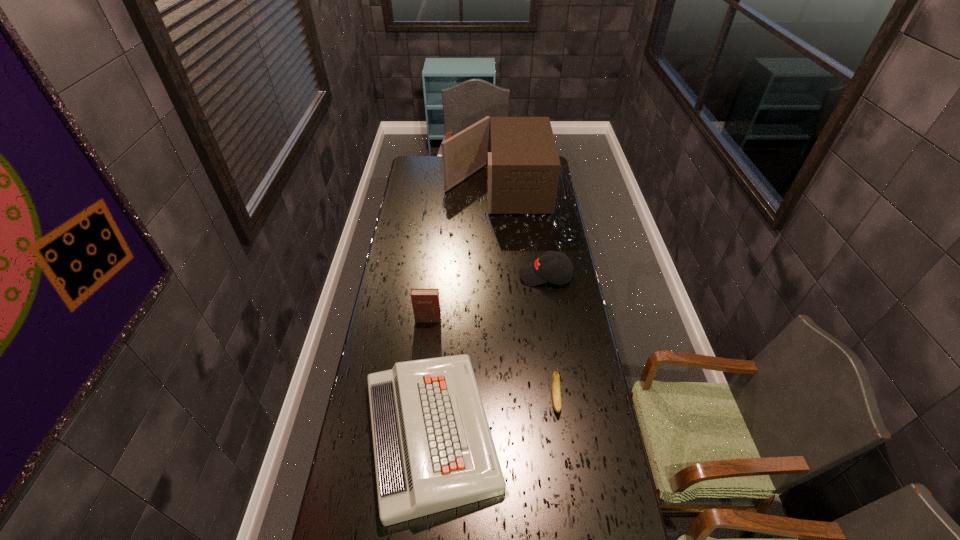
At what (x,y) coordinates should I click in order to perform the action: click on vacant region that satisfies the following two spatial constraints: 1. on the front-facing side of the second farthest object; 2. at the start of the peel on the banana. Please return your answer as a coordinate pair (x, y). Image resolution: width=960 pixels, height=540 pixels. Looking at the image, I should click on pyautogui.click(x=564, y=400).